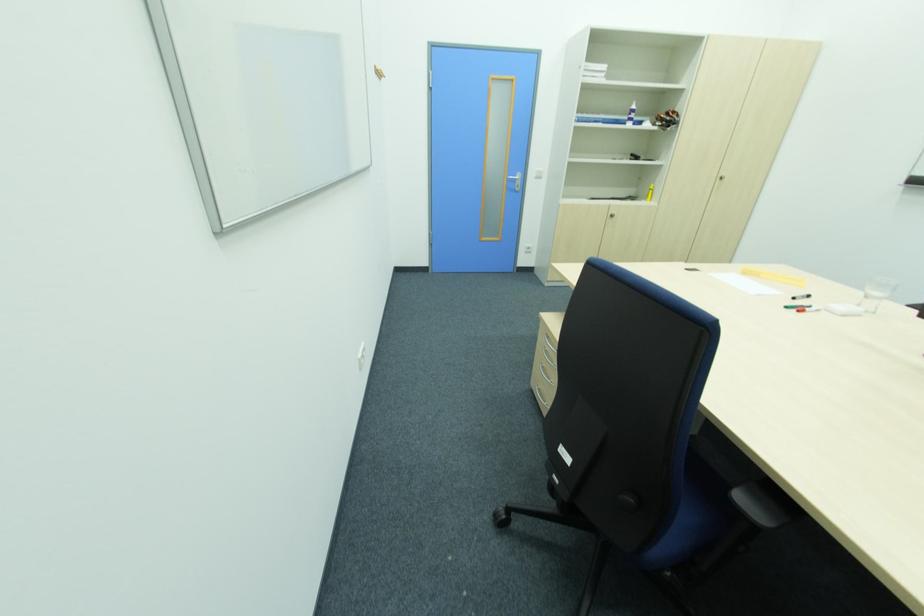
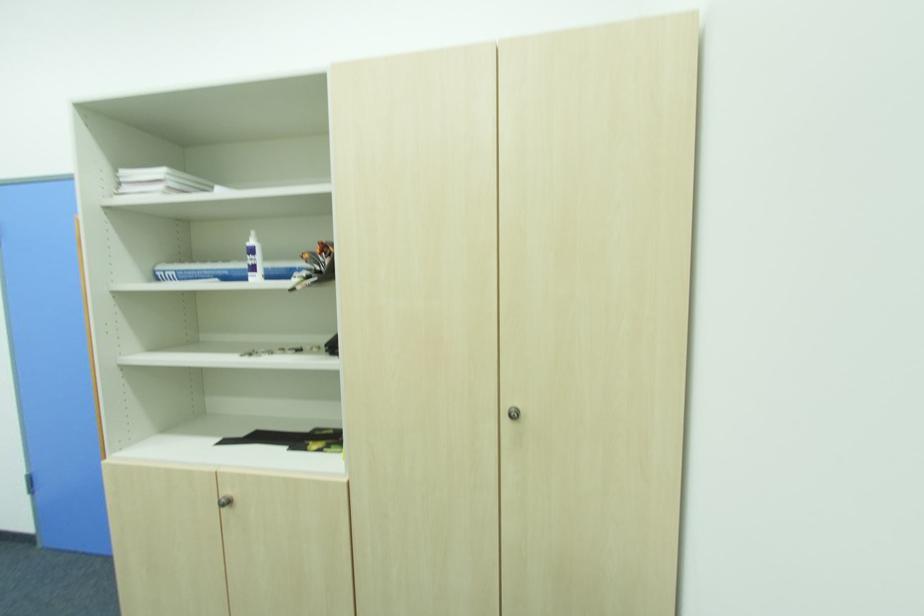
Where in the second image is the point corresponding to (x=637, y=108) from the first image?

(254, 243)